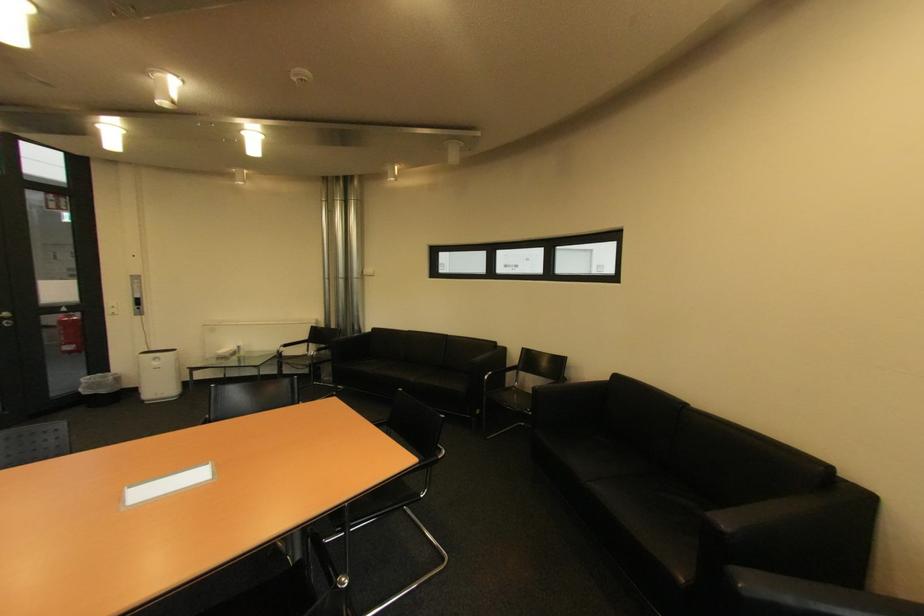
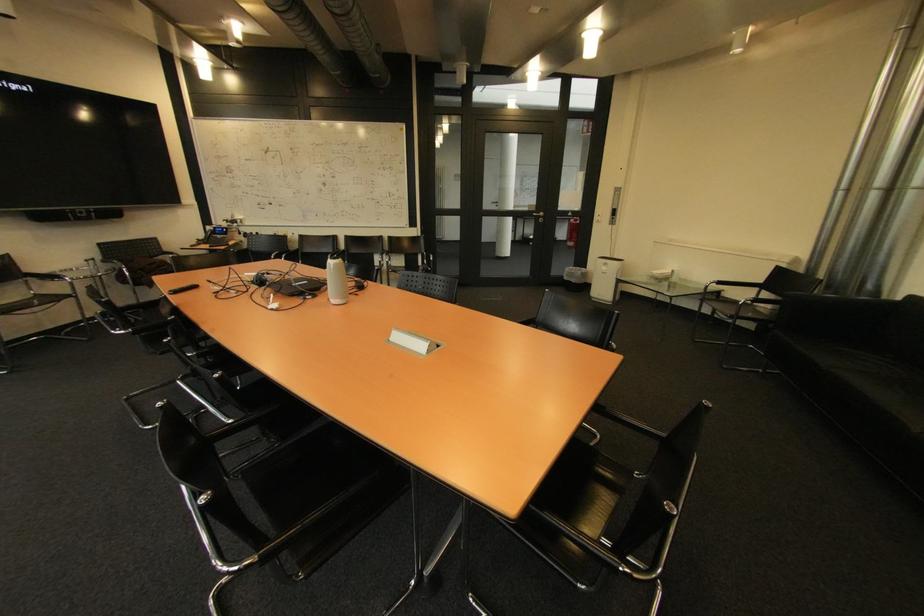
Locate, in the second image, the point that corresponds to (94,394) in the first image.

(574, 280)